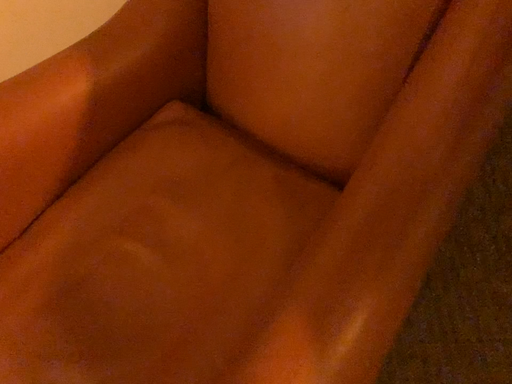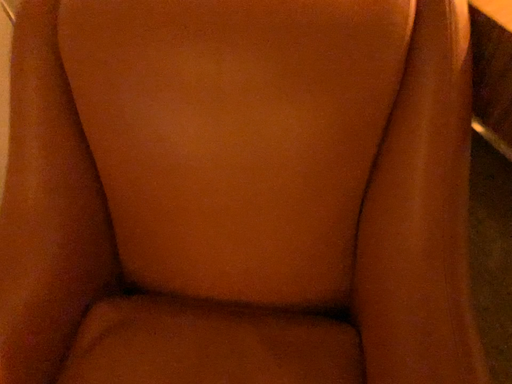
Question: How did the camera likely rotate when shooting the video?

Choices:
 (A) rotated upward
 (B) rotated downward

Answer: (A)